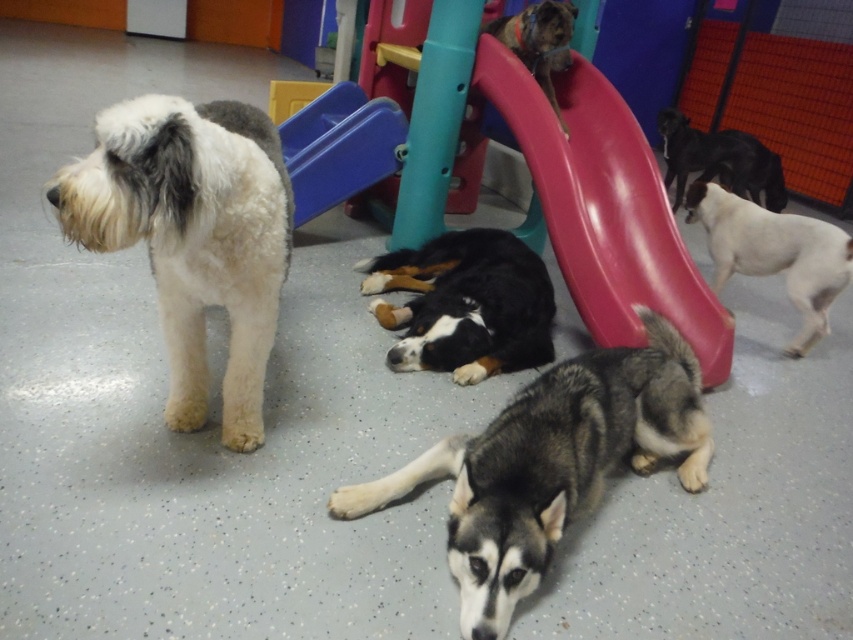
Is white fluffy dog at left further to camera compared to white fur dog at right?

No, it is in front of white fur dog at right.

Can you confirm if white fluffy dog at left is positioned below white fur dog at right?

Correct, white fluffy dog at left is located below white fur dog at right.

Describe the element at coordinates (192, 236) in the screenshot. This screenshot has height=640, width=853. I see `white fluffy dog at left` at that location.

I want to click on white fluffy dog at left, so click(192, 236).

Can you confirm if white fluffy dog at left is positioned to the right of gray fur dog at lower center?

In fact, white fluffy dog at left is to the left of gray fur dog at lower center.

Does white fluffy dog at left lie behind gray fur dog at lower center?

No, it is not.

Which is in front, point (194, 200) or point (428, 467)?

Point (194, 200) is in front.

I want to click on white fluffy dog at left, so click(192, 236).

Can you confirm if black fur at center is thinner than black glossy dog at upper right?

Correct, black fur at center's width is less than black glossy dog at upper right's.

Is point (483, 326) farther from viewer compared to point (756, 164)?

No, it is not.

Identify the location of black fur at center. This screenshot has width=853, height=640. (463, 305).